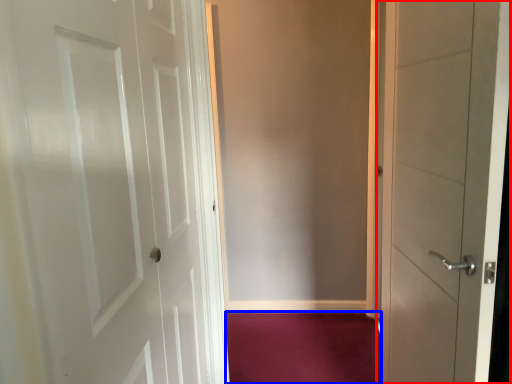
Question: Which object is closer to the camera taking this photo, door (highlighted by a red box) or plain (highlighted by a blue box)?

Choices:
 (A) door
 (B) plain

Answer: (A)